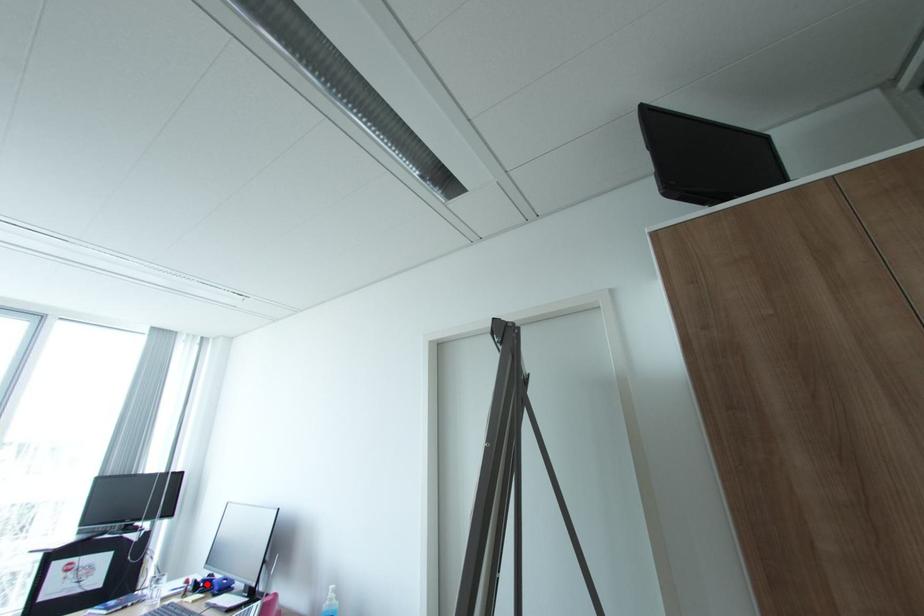
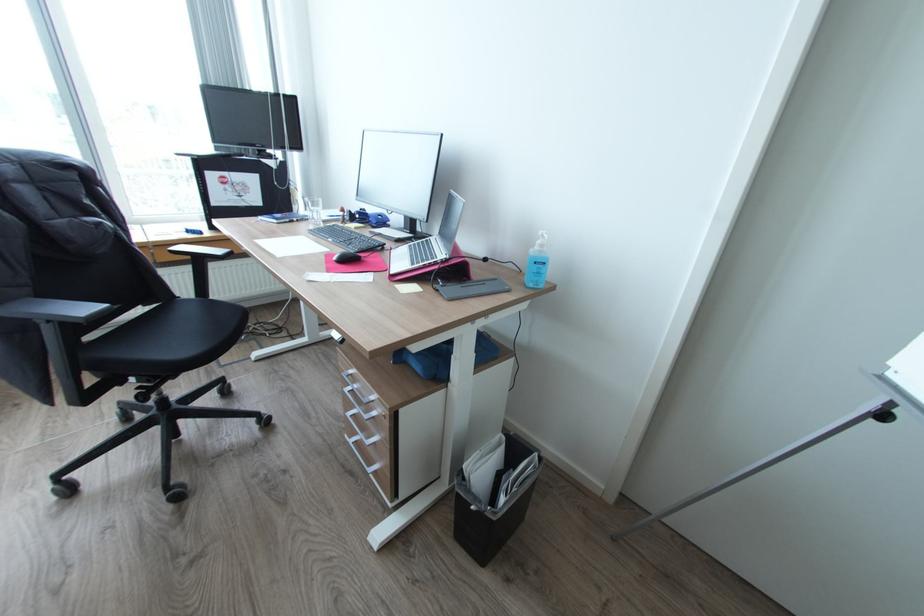
Question: I am providing you with two images of the same scene from different viewpoints. A red point is marked on the first image. At the location where the point appears in image 1, is it still visible in image 2?

Choices:
 (A) Yes
 (B) No

Answer: (A)